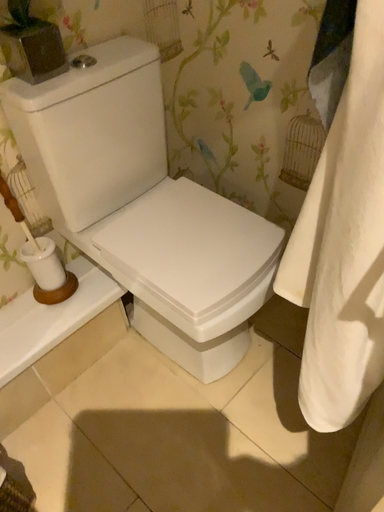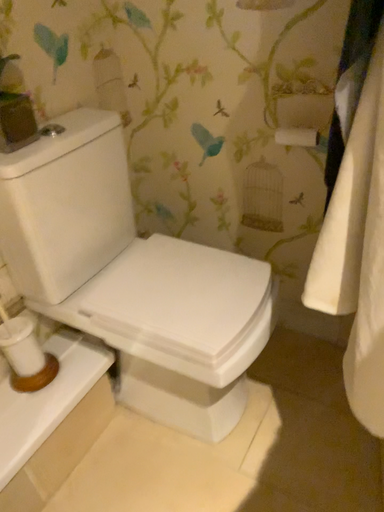
Question: Which way did the camera rotate in the video?

Choices:
 (A) rotated left
 (B) rotated right

Answer: (B)